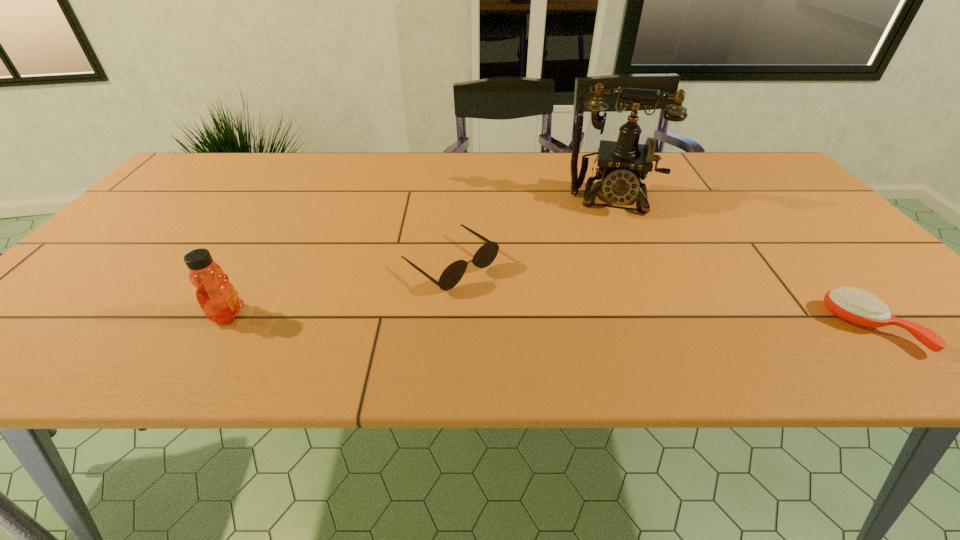
You are a GUI agent. You are given a task and a screenshot of the screen. Output one action in this format:
    pyautogui.click(x=<x>, y=<y>)
    Task: Click on the blank space at the near edge of the desktop
    The width and height of the screenshot is (960, 540).
    Given the screenshot: What is the action you would take?
    pyautogui.click(x=108, y=328)

Where is `free space at the left edge of the desktop`? This screenshot has width=960, height=540. free space at the left edge of the desktop is located at coordinates (154, 207).

In the image, there is a desktop. Identify the location of free space at the right edge. (813, 245).

The height and width of the screenshot is (540, 960). In the image, there is a desktop. What are the coordinates of `free space at the near left corner` in the screenshot? It's located at (114, 312).

The height and width of the screenshot is (540, 960). In order to click on free space between the tallest object and the third tallest object in this screenshot , I will do `click(532, 232)`.

At what (x,y) coordinates should I click in order to perform the action: click on free space between the tallest object and the leftmost object. Please return your answer as a coordinate pair (x, y). The image size is (960, 540). Looking at the image, I should click on (420, 257).

The image size is (960, 540). Find the location of `vacant point located between the telephone and the sunglasses`. vacant point located between the telephone and the sunglasses is located at coordinates (532, 232).

Where is `vacant area between the hairbrush and the sunglasses`? The image size is (960, 540). vacant area between the hairbrush and the sunglasses is located at coordinates (661, 296).

Locate an element on the screen. This screenshot has width=960, height=540. free area in between the hairbrush and the honey is located at coordinates (550, 321).

Image resolution: width=960 pixels, height=540 pixels. Identify the location of empty location between the farthest object and the third object from right to left. (532, 232).